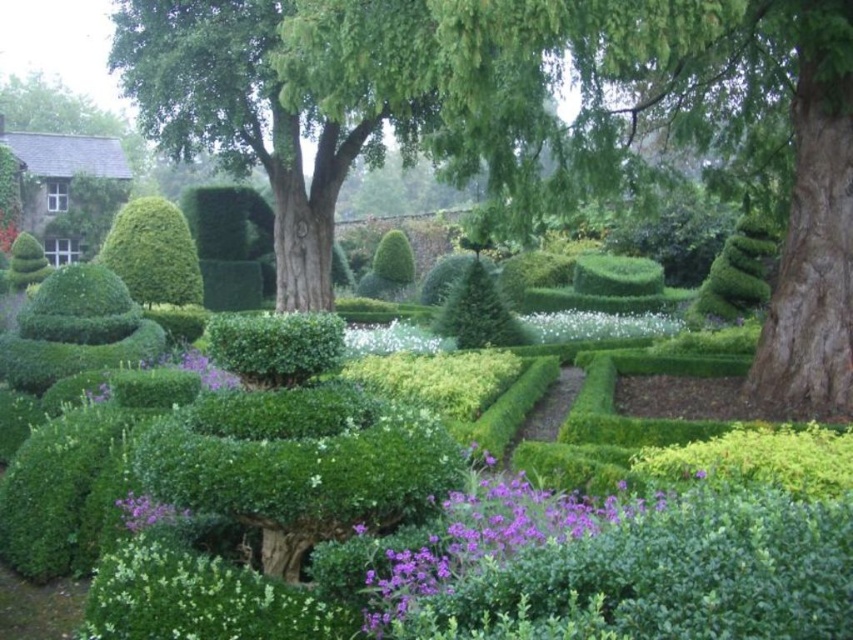
Does point (235, 582) come farther from viewer compared to point (144, 508)?

No, it is not.

At what (x,y) coordinates should I click in order to perform the action: click on white matte flower at center. Please return your answer as a coordinate pair (x, y). Looking at the image, I should click on (200, 598).

Who is positioned more to the right, white matte flower at center or white fluffy flowers at center?

white fluffy flowers at center is more to the right.

Does point (161, 540) come behind point (590, 321)?

No, (161, 540) is closer to viewer.

This screenshot has width=853, height=640. What do you see at coordinates (200, 598) in the screenshot?
I see `white matte flower at center` at bounding box center [200, 598].

Locate an element on the screen. white matte flower at center is located at coordinates (200, 598).

Can you confirm if green leafy tree at center is smaller than white fluffy flower at center?

Incorrect, green leafy tree at center is not smaller in size than white fluffy flower at center.

Is point (804, 394) in front of point (402, 333)?

Yes.

The width and height of the screenshot is (853, 640). In order to click on green leafy tree at center in this screenshot , I will do `click(627, 122)`.